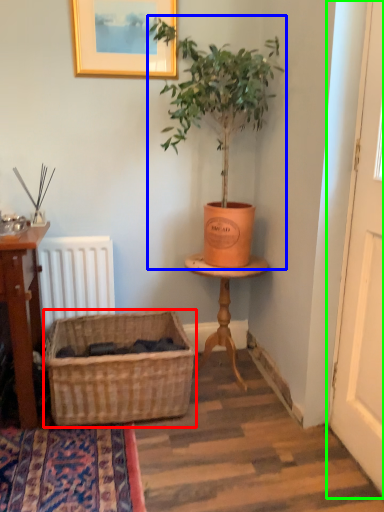
Question: Which is nearer to the basket (highlighted by a red box)? houseplant (highlighted by a blue box) or screen door (highlighted by a green box).

Choices:
 (A) houseplant
 (B) screen door

Answer: (A)